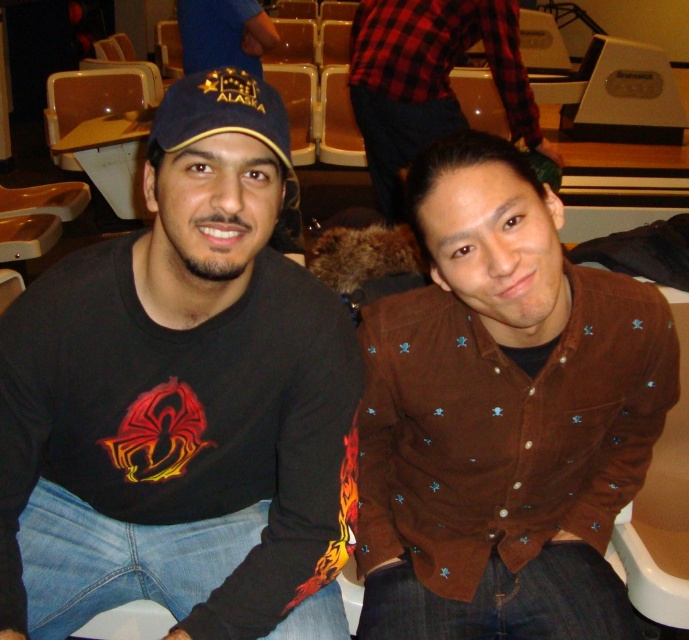
Question: Among these points, which one is farthest from the camera?

Choices:
 (A) (103, 445)
 (B) (426, 637)

Answer: (B)

Question: Which object is the farthest from the red plaid shirt at upper center?

Choices:
 (A) brown corduroy shirt at center
 (B) black matte t-shirt at center
 (C) blue fabric cap at upper center

Answer: (B)

Question: Is black matte t-shirt at center above red plaid shirt at upper center?

Choices:
 (A) no
 (B) yes

Answer: (A)

Question: Can you confirm if black matte t-shirt at center is positioned above blue fabric cap at upper center?

Choices:
 (A) no
 (B) yes

Answer: (A)

Question: Which object appears closest to the camera in this image?

Choices:
 (A) brown corduroy shirt at center
 (B) red plaid shirt at upper center
 (C) blue fabric cap at upper center
 (D) black matte t-shirt at center

Answer: (D)

Question: Is brown corduroy shirt at center to the right of blue fabric cap at upper center from the viewer's perspective?

Choices:
 (A) no
 (B) yes

Answer: (B)